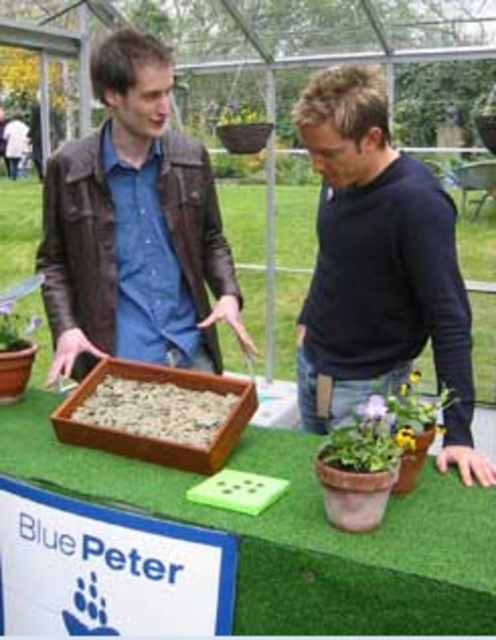
Describe the element at coordinates (299, 532) in the screenshot. I see `wooden tray at center` at that location.

Is point (477, 522) positioned after point (130, 93)?

No, it is in front of (130, 93).

Where is `wooden tray at center`? wooden tray at center is located at coordinates (299, 532).

Does point (343, 548) lie in front of point (358, 406)?

Yes, point (343, 548) is in front of point (358, 406).

From the picture: Does wooden tray at center appear under green matte flower at center?

Yes.

Who is more forward, (271, 572) or (368, 404)?

Point (271, 572) is in front.

What are the coordinates of `wooden tray at center` in the screenshot? It's located at (299, 532).

Between point (149, 186) and point (386, 365), which one is positioned behind?

Point (149, 186)

How far apart are brown leather jacket at center and black matte sweater at center?

brown leather jacket at center is 17.30 inches from black matte sweater at center.

Does point (149, 38) come in front of point (451, 412)?

That is False.

Where is `brown leather jacket at center`? Image resolution: width=496 pixels, height=640 pixels. brown leather jacket at center is located at coordinates (133, 225).